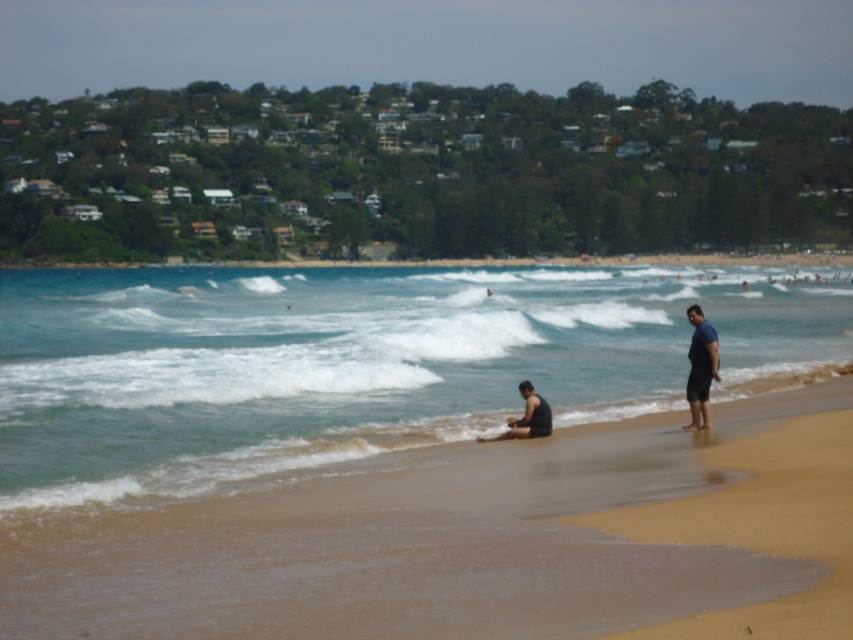
Question: Which of these objects is positioned farthest from the black matte shirt at lower center?

Choices:
 (A) blue fabric shorts at right
 (B) clear blue water at center

Answer: (B)

Question: Does clear blue water at center have a lesser width compared to brown sandy beach at lower center?

Choices:
 (A) yes
 (B) no

Answer: (B)

Question: Is clear blue water at center to the left of black matte shirt at lower center from the viewer's perspective?

Choices:
 (A) no
 (B) yes

Answer: (B)

Question: Which point is farther from the camera taking this photo?

Choices:
 (A) (349, 605)
 (B) (694, 326)
 (C) (529, 410)
 (D) (660, 360)

Answer: (D)

Question: Which point is farther from the camera taking this photo?

Choices:
 (A) (524, 381)
 (B) (708, 365)
 (C) (607, 301)

Answer: (C)

Question: Does clear blue water at center lie in front of blue fabric shorts at right?

Choices:
 (A) yes
 (B) no

Answer: (A)